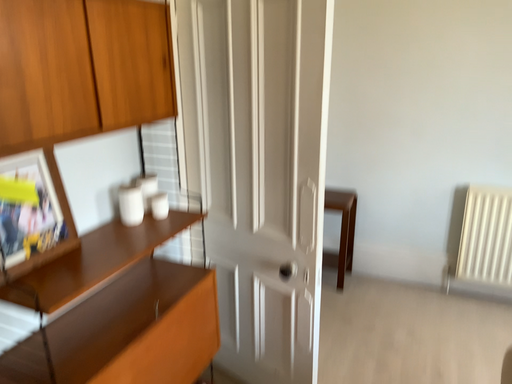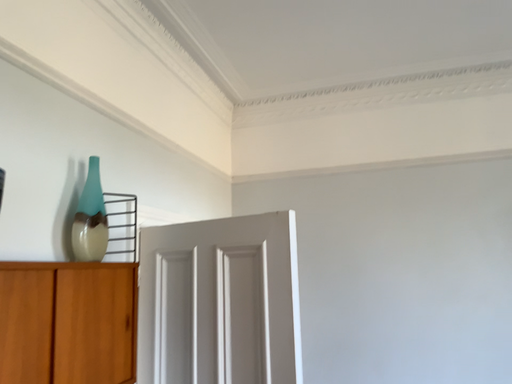
Question: Which way did the camera rotate in the video?

Choices:
 (A) rotated downward
 (B) rotated upward

Answer: (B)